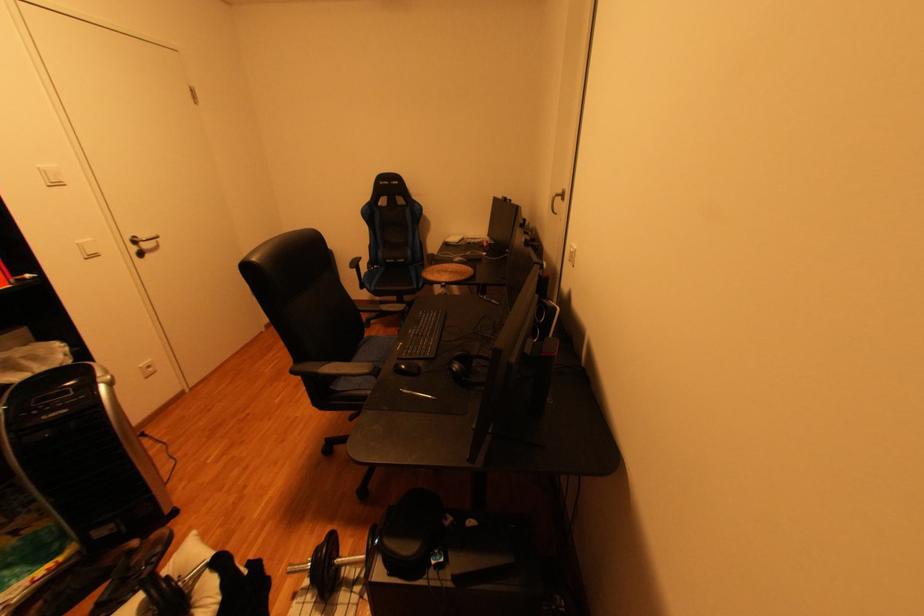
This screenshot has height=616, width=924. I want to click on chair sitting surface, so click(390, 272).